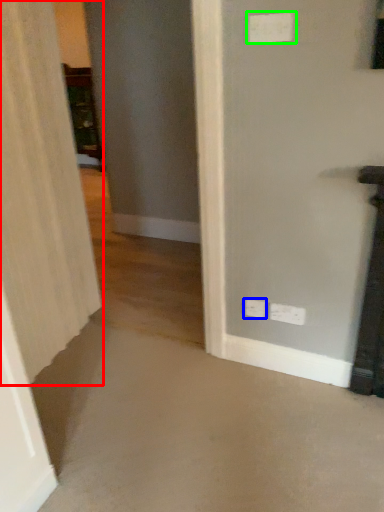
Question: Which object is the closest to the curtain (highlighted by a red box)? Choose among these: electric outlet (highlighted by a blue box) or electric outlet (highlighted by a green box).

Choices:
 (A) electric outlet
 (B) electric outlet

Answer: (A)